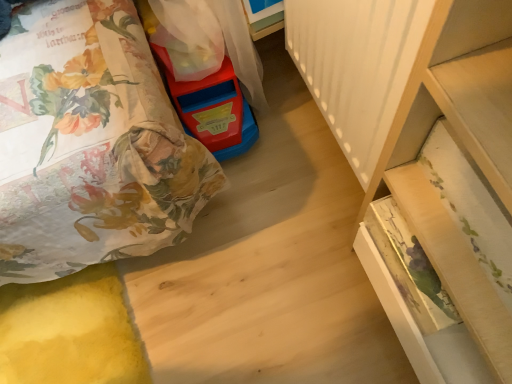
Question: Would you say rubberized plastic toy at upper left is part of wooden drawer at lower right's contents?

Choices:
 (A) yes
 (B) no

Answer: (B)

Question: Does wooden drawer at lower right touch rubberized plastic toy at upper left?

Choices:
 (A) no
 (B) yes

Answer: (A)

Question: From a real-world perspective, is wooden drawer at lower right positioned over rubberized plastic toy at upper left based on gravity?

Choices:
 (A) yes
 (B) no

Answer: (A)

Question: From the image's perspective, is wooden drawer at lower right on top of rubberized plastic toy at upper left?

Choices:
 (A) yes
 (B) no

Answer: (B)

Question: From the image's perspective, is wooden drawer at lower right located beneath rubberized plastic toy at upper left?

Choices:
 (A) no
 (B) yes

Answer: (B)

Question: Does wooden drawer at lower right have a lesser height compared to rubberized plastic toy at upper left?

Choices:
 (A) no
 (B) yes

Answer: (A)

Question: Does rubberized plastic toy at upper left have a lesser width compared to wooden drawer at lower right?

Choices:
 (A) yes
 (B) no

Answer: (B)

Question: Are rubberized plastic toy at upper left and wooden drawer at lower right far apart?

Choices:
 (A) yes
 (B) no

Answer: (B)

Question: From a real-world perspective, is rubberized plastic toy at upper left positioned under wooden drawer at lower right based on gravity?

Choices:
 (A) no
 (B) yes

Answer: (B)

Question: Can you confirm if rubberized plastic toy at upper left is shorter than wooden drawer at lower right?

Choices:
 (A) yes
 (B) no

Answer: (A)

Question: Can you confirm if rubberized plastic toy at upper left is positioned to the left of wooden drawer at lower right?

Choices:
 (A) no
 (B) yes

Answer: (B)

Question: Is rubberized plastic toy at upper left wider than wooden drawer at lower right?

Choices:
 (A) no
 (B) yes

Answer: (B)

Question: Would you say rubberized plastic toy at upper left is to the left or to the right of wooden drawer at lower right in the picture?

Choices:
 (A) right
 (B) left

Answer: (B)